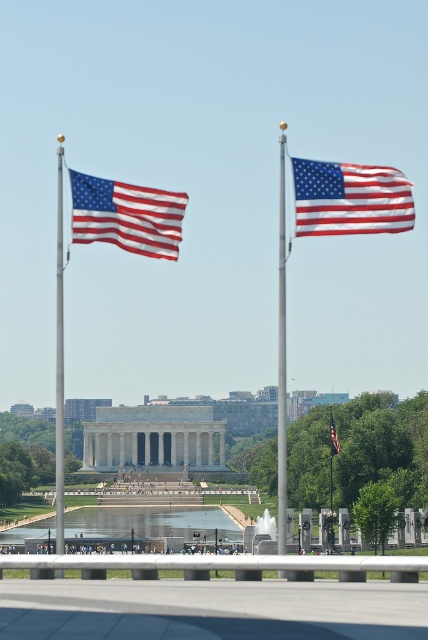
Question: Which object appears closest to the camera in this image?

Choices:
 (A) transparent glass fountain at center
 (B) matte fabric flag at center
 (C) silver metallic flagpole at left
 (D) matte fabric flag at upper right

Answer: (C)

Question: Which point is closer to the camera?

Choices:
 (A) (264, 515)
 (B) (332, 429)
 (C) (365, 212)
 (D) (59, 452)

Answer: (C)

Question: From the image, what is the correct spatial relationship of matte fabric flag at left in relation to silver metallic flagpole at left?

Choices:
 (A) above
 (B) below

Answer: (B)

Question: Observing the image, what is the correct spatial positioning of silver metallic flagpole at left in reference to transparent glass fountain at center?

Choices:
 (A) above
 (B) below

Answer: (A)

Question: Can you confirm if matte fabric flag at left is thinner than transparent glass fountain at center?

Choices:
 (A) yes
 (B) no

Answer: (B)

Question: Which point is closer to the camera?

Choices:
 (A) (282, 298)
 (B) (335, 448)
 (C) (360, 209)

Answer: (C)